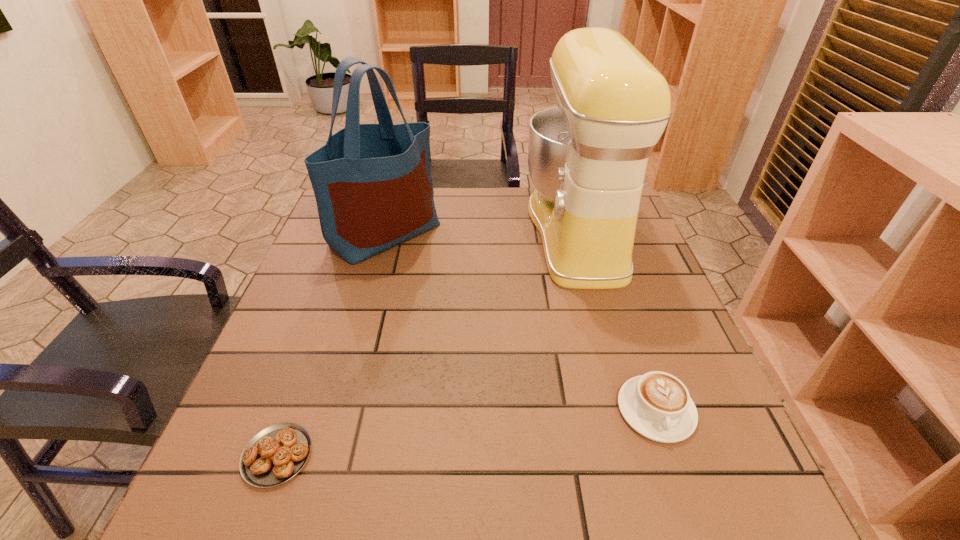
This screenshot has width=960, height=540. I want to click on mixer, so 587,157.

Identify the location of handbag. The image size is (960, 540). 373,187.

Where is `cappuccino`? The height and width of the screenshot is (540, 960). cappuccino is located at coordinates (657, 405).

What are the coordinates of `pastry` in the screenshot? It's located at (276, 454).

In order to click on vacant region located on the side of the mixer with the control knob in this screenshot , I will do `click(387, 232)`.

Where is `free spot located 0.340m on the side of the mixer with the control knob`? Image resolution: width=960 pixels, height=540 pixels. free spot located 0.340m on the side of the mixer with the control knob is located at coordinates (404, 232).

Where is `free point located 0.400m on the side of the mixer with the control knob`? This screenshot has width=960, height=540. free point located 0.400m on the side of the mixer with the control knob is located at coordinates point(383,232).

This screenshot has height=540, width=960. I want to click on vacant area situated 0.070m on the right of the handbag, so click(465, 233).

The image size is (960, 540). I want to click on vacant space situated 0.120m with the handle on the right side of the cappuccino, so click(x=693, y=519).

Locate an element on the screen. This screenshot has width=960, height=540. vacant space located 0.360m on the right of the pastry is located at coordinates (524, 455).